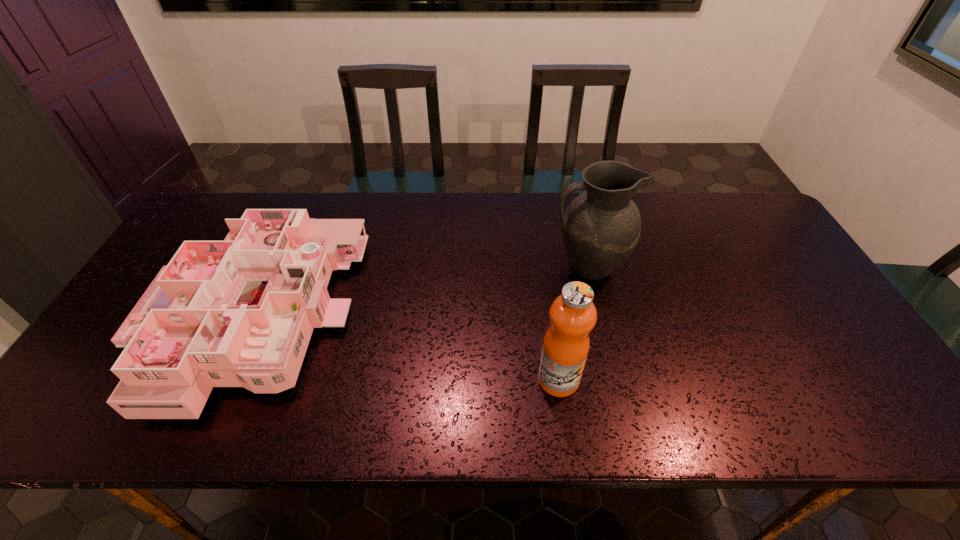
This screenshot has height=540, width=960. Identify the location of dollhouse at the near edge. (236, 313).

Where is `object located in the left edge section of the desktop`? This screenshot has height=540, width=960. object located in the left edge section of the desktop is located at coordinates (236, 313).

The height and width of the screenshot is (540, 960). Identify the location of object positioned at the near left corner. (236, 313).

In the image, there is a desktop. Where is `vacant space at the far edge`? vacant space at the far edge is located at coordinates (368, 219).

I want to click on free space at the near edge, so pyautogui.click(x=578, y=404).

You are a GUI agent. You are given a task and a screenshot of the screen. Output one action in this format:
    pyautogui.click(x=<x>, y=<y>)
    Task: Click on the free location at the right edge of the desktop
    The width and height of the screenshot is (960, 540).
    Given the screenshot: What is the action you would take?
    pyautogui.click(x=744, y=240)

Where is `free space at the near left corner of the desktop`? free space at the near left corner of the desktop is located at coordinates (77, 429).

Where is `vacant space that's between the dollhouse and the fruit juice`? vacant space that's between the dollhouse and the fruit juice is located at coordinates (404, 349).

The height and width of the screenshot is (540, 960). What are the coordinates of `free space between the leftmost object and the pitcher` in the screenshot? It's located at (419, 293).

At what (x,y) coordinates should I click in order to perform the action: click on free space between the shortest object and the pitcher. Please return your answer as a coordinate pair (x, y). The image size is (960, 540). Looking at the image, I should click on (419, 293).